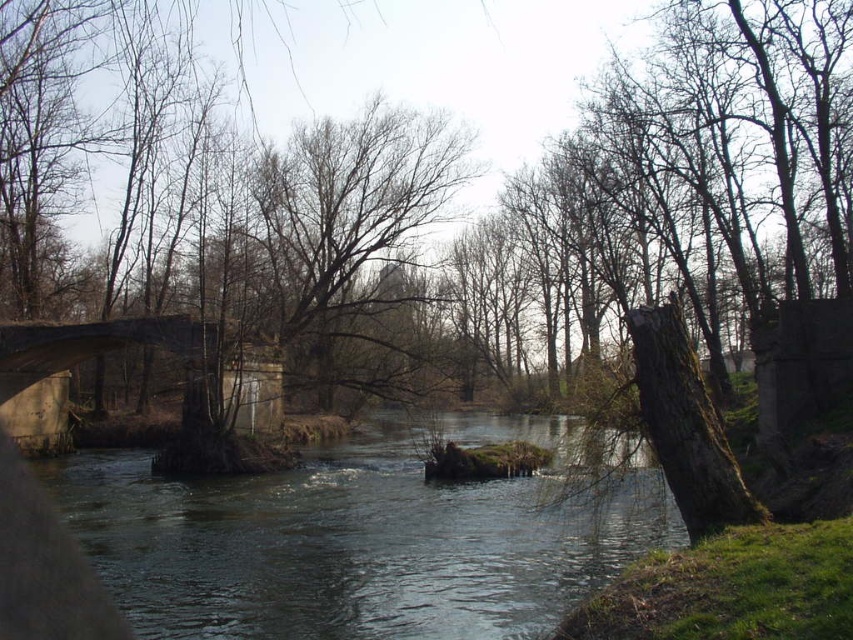
You are a hiker who wants to cross the river. You see the clear water at center and the concrete bridge at center. Which one should you step onto to safely cross the river?

You should step onto the concrete bridge at center to safely cross the river because the clear water at center is positioned under it, meaning the bridge is the solid structure above the water.

You are standing at the point with coordinates point (45, 326) and want to walk to the point with coordinates point (438, 163). Is the destination point behind you or in front of you?

The destination point (438, 163) is behind point (45, 326), so it is behind you.